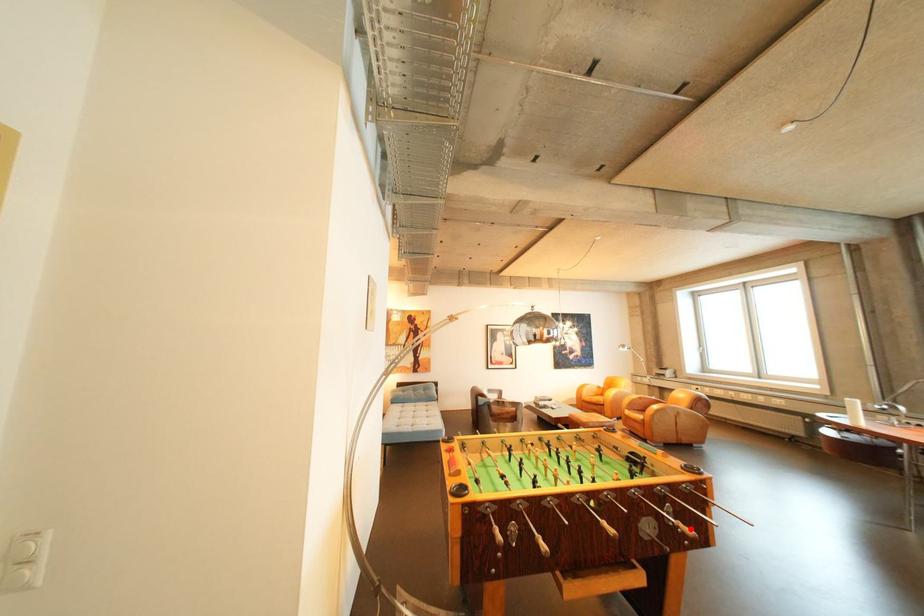
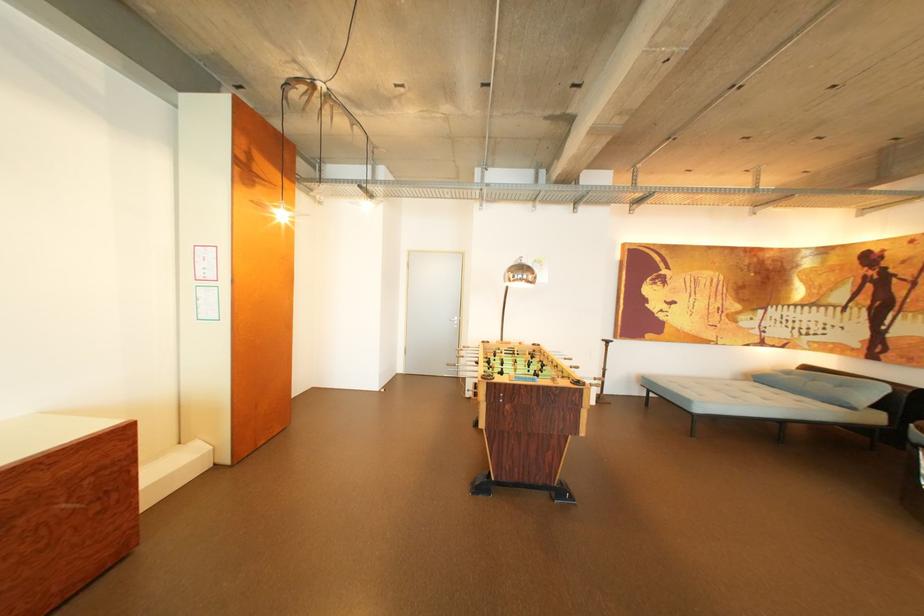
Question: I am providing you with two images of the same scene from different viewpoints. A red point is marked on the first image. At the location where the point appears in image 1, is it still visible in image 2?

Choices:
 (A) Yes
 (B) No

Answer: (B)